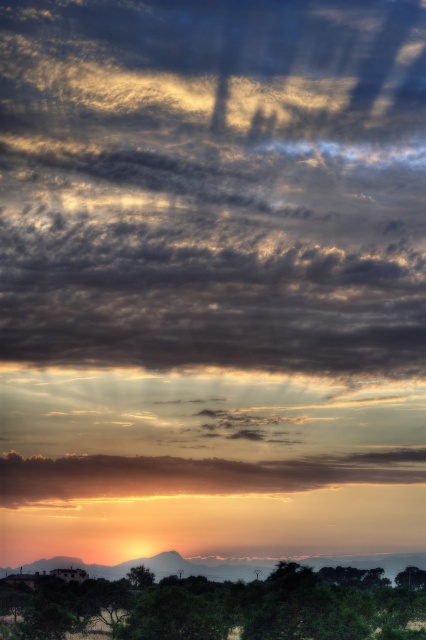
In the scene shown: Is golden textured clouds at upper center to the right of golden matte cloud at lower center from the viewer's perspective?

In fact, golden textured clouds at upper center is to the left of golden matte cloud at lower center.

You are a GUI agent. You are given a task and a screenshot of the screen. Output one action in this format:
    pyautogui.click(x=<x>, y=<y>)
    Task: Click on the golden textured clouds at upper center
    
    Given the screenshot: What is the action you would take?
    pyautogui.click(x=213, y=184)

Locate an element on the screen. The image size is (426, 640). golden textured clouds at upper center is located at coordinates (213, 184).

Who is higher up, golden matte cloud at lower center or green leafy tree at lower right?

golden matte cloud at lower center is above.

Who is more forward, (63, 465) or (408, 572)?

Point (408, 572) is in front.

Identify the location of golden matte cloud at lower center. (192, 474).

Is golden textured clouds at upper center taller than green leafy tree at lower right?

Indeed, golden textured clouds at upper center has a greater height compared to green leafy tree at lower right.

The image size is (426, 640). I want to click on golden textured clouds at upper center, so click(213, 184).

The width and height of the screenshot is (426, 640). Describe the element at coordinates (213, 184) in the screenshot. I see `golden textured clouds at upper center` at that location.

Image resolution: width=426 pixels, height=640 pixels. Identify the location of golden textured clouds at upper center. (213, 184).